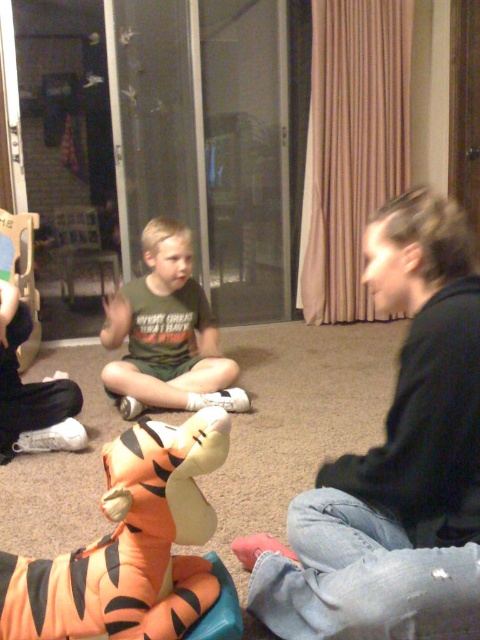
Can you confirm if orange plush tiger at lower left is bigger than green matte shirt at center?

Actually, orange plush tiger at lower left might be smaller than green matte shirt at center.

Who is more forward, (128, 480) or (144, 348)?

Point (128, 480) is more forward.

Locate an element on the screen. orange plush tiger at lower left is located at coordinates (130, 545).

Does black cotton shirt at upper right have a larger size compared to orange plush tiger at lower left?

→ Yes, black cotton shirt at upper right is bigger than orange plush tiger at lower left.

Who is positioned more to the left, black cotton shirt at upper right or orange plush tiger at lower left?

orange plush tiger at lower left is more to the left.

Between point (458, 228) and point (132, 477), which one is positioned behind?

The point (458, 228) is behind.

The image size is (480, 640). I want to click on black cotton shirt at upper right, so click(x=395, y=461).

Is point (326, 518) positioned in front of point (121, 360)?

Yes.

Does black cotton shirt at upper right appear on the right side of green matte shirt at center?

Indeed, black cotton shirt at upper right is positioned on the right side of green matte shirt at center.

This screenshot has width=480, height=640. What are the coordinates of `black cotton shirt at upper right` in the screenshot? It's located at (395, 461).